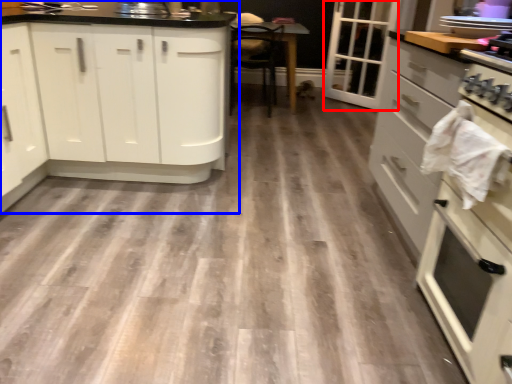
Question: Which point is closer to the camera, glass door (highlighted by a red box) or cabinetry (highlighted by a blue box)?

Choices:
 (A) glass door
 (B) cabinetry

Answer: (B)